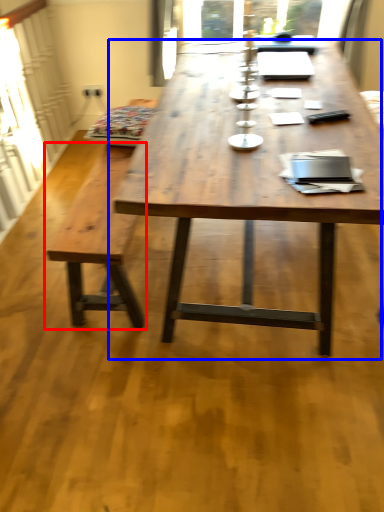
Question: Which object is closer to the camera taking this photo, bench (highlighted by a red box) or coffee table (highlighted by a blue box)?

Choices:
 (A) bench
 (B) coffee table

Answer: (B)